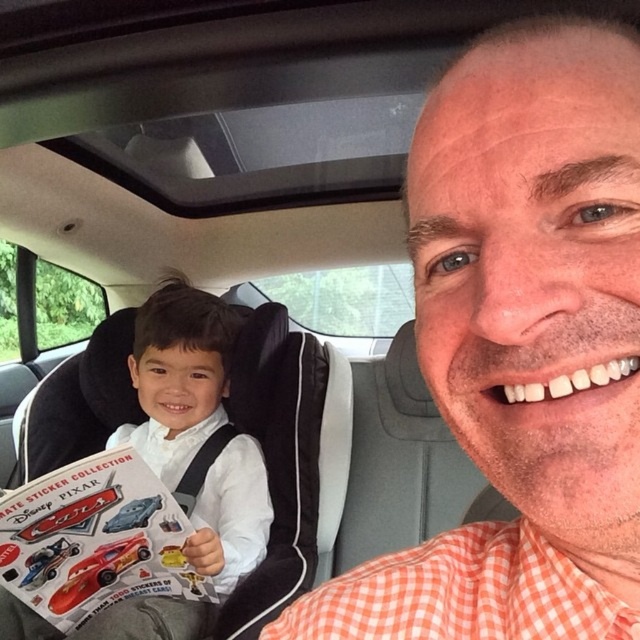
Consider the image. Who is more distant from viewer, (x=548, y=401) or (x=208, y=484)?

Positioned behind is point (x=208, y=484).

Between point (634, 273) and point (218, 337), which one is positioned behind?

Positioned behind is point (218, 337).

At what (x,y) coordinates should I click in order to perform the action: click on orange checkered shirt at center. Please return your answer as a coordinate pair (x, y). This screenshot has height=640, width=640. Looking at the image, I should click on (522, 346).

Does point (224, 308) come farther from viewer compared to point (88, 584)?

Yes, point (224, 308) is farther from viewer.

Is point (196, 312) farther from camera compared to point (81, 580)?

Yes, it is.

This screenshot has width=640, height=640. In order to click on white smooth shirt at center in this screenshot , I will do [179, 376].

Is orange checkered shirt at center further to the viewer compared to shiny red toy car at center?

No, orange checkered shirt at center is closer to the viewer.

Where is `orange checkered shirt at center`? This screenshot has height=640, width=640. orange checkered shirt at center is located at coordinates (522, 346).